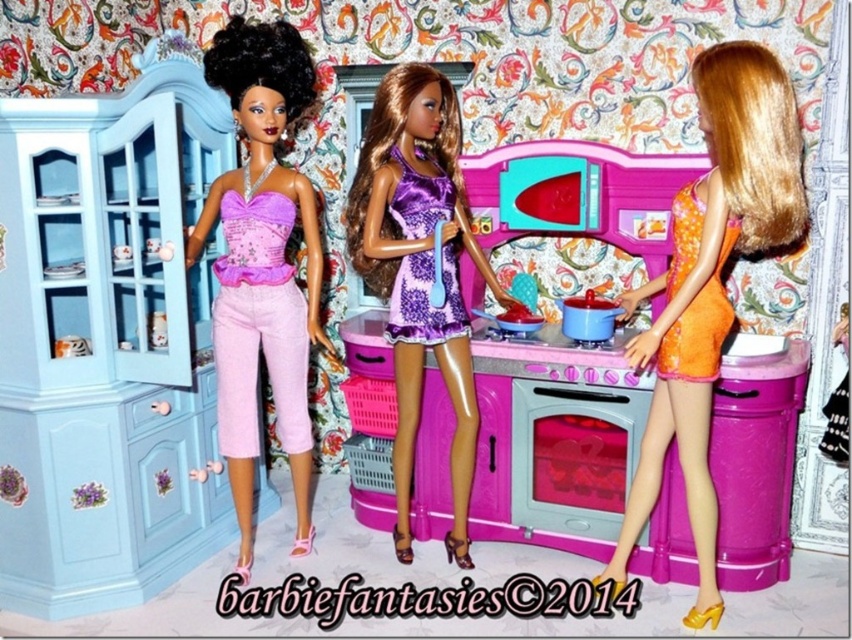
Can you confirm if orange satin dress at center is thinner than matte purple fabric dress at center?

No.

Who is higher up, orange satin dress at center or matte purple fabric dress at center?

matte purple fabric dress at center is above.

Is point (764, 198) closer to viewer compared to point (281, 221)?

That is True.

Identify the location of orange satin dress at center. Image resolution: width=852 pixels, height=640 pixels. (711, 285).

Is orange satin dress at center bigger than purple satin dress at center?

No, orange satin dress at center is not bigger than purple satin dress at center.

Between orange satin dress at center and purple satin dress at center, which one is positioned higher?

purple satin dress at center is above.

The image size is (852, 640). I want to click on orange satin dress at center, so click(711, 285).

Does matte purple fabric dress at center appear over pink glossy oven at center?

Yes, matte purple fabric dress at center is above pink glossy oven at center.

Can you confirm if matte purple fabric dress at center is wider than pink glossy oven at center?

Indeed, matte purple fabric dress at center has a greater width compared to pink glossy oven at center.

Between point (306, 339) and point (548, 460), which one is positioned behind?

Point (548, 460)

Locate an element on the screen. matte purple fabric dress at center is located at coordinates (262, 262).